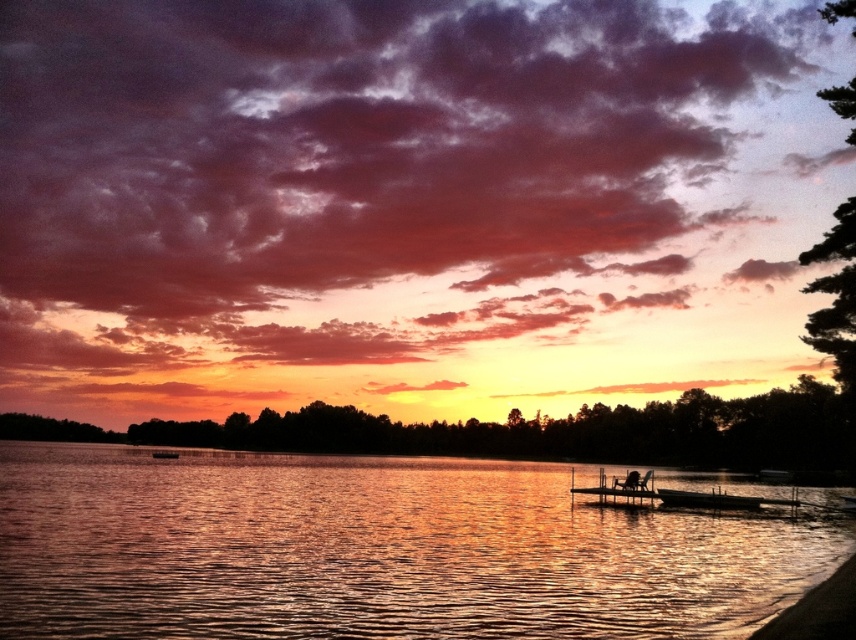
You are a photographer standing at the edge of the lake. You want to take a photo that includes both the glistening water at center and the dark brown wooden boat at center. Given that your camera has a maximum focus range of 120 feet, will you be able to capture both objects in focus without moving your position?

The glistening water at center and dark brown wooden boat at center are 124.51 feet apart. Since the distance between them exceeds the camera maximum focus range of 120 feet, you won exceed the camera maximum focus range of 120 feet, so you will not be able to capture both objects in focus without moving your position.

You are standing on the lakeshore and see the glistening water at center and the dark brown wooden boat at center. Which object appears taller from your viewpoint?

The glistening water at center appears taller than the dark brown wooden boat at center from your viewpoint.

You are standing on the wooden dock at center and want to reach the dark brown wooden boat at center. Which direction should you move to get there?

The wooden dock at center is located above the dark brown wooden boat at center, so you should move downward to reach it.